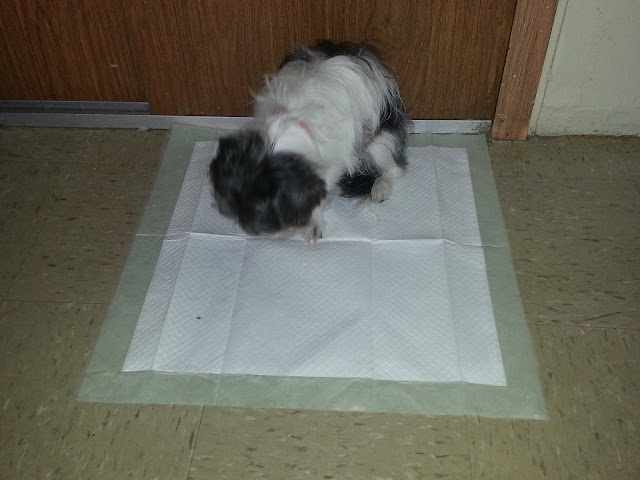
You are a GUI agent. You are given a task and a screenshot of the screen. Output one action in this format:
    pyautogui.click(x=<x>, y=<y>)
    Task: Click on the top left of pee pad
    
    Given the screenshot: What is the action you would take?
    pyautogui.click(x=173, y=126)